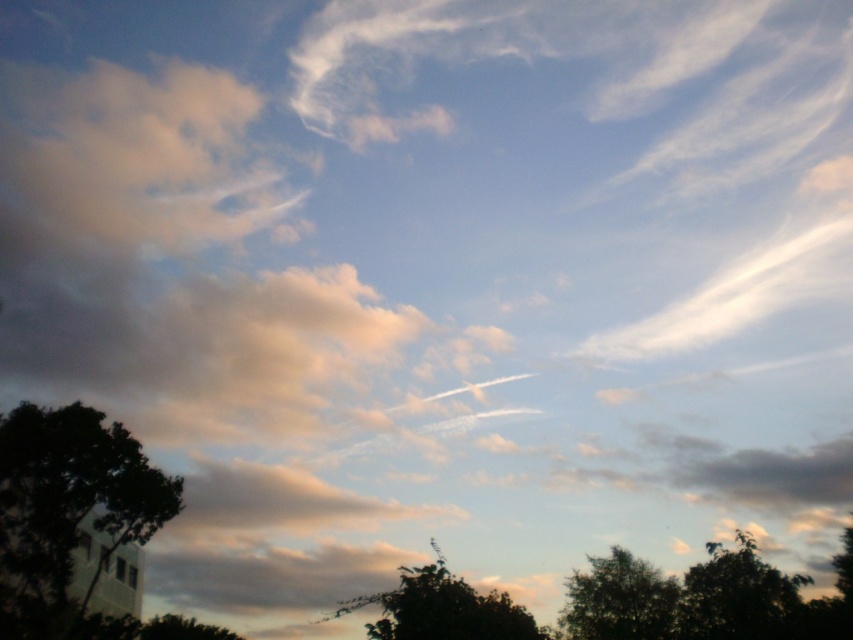
You are standing in the middle of the scene and want to take a photo of the dark green leafy tree at lower right. In which direction should you point your camera?

You should point your camera to the lower right direction to capture the dark green leafy tree at lower right since it is located at point [740,596].